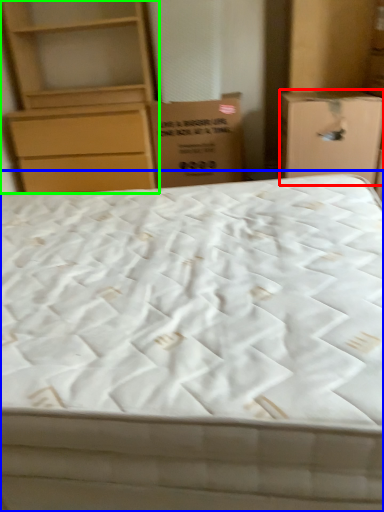
Question: Which object is the closest to the cardboard box (highlighted by a red box)? Choose among these: bed (highlighted by a blue box) or chest of drawers (highlighted by a green box).

Choices:
 (A) bed
 (B) chest of drawers

Answer: (A)